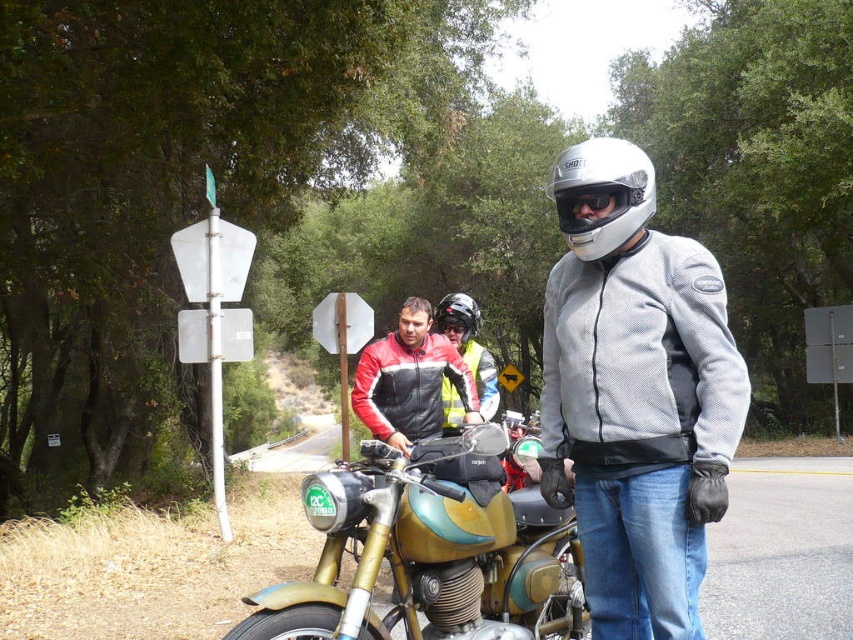
Question: Does gold metallic motorcycle at center have a larger size compared to glossy black helmet at center?

Choices:
 (A) no
 (B) yes

Answer: (A)

Question: Can you confirm if gold metallic motorcycle at center is positioned to the left of silver metallic helmet at center?

Choices:
 (A) yes
 (B) no

Answer: (A)

Question: Which is nearer to the red and black leather jacket at center?

Choices:
 (A) gold metallic motorcycle at center
 (B) silver metallic helmet at center
 (C) silver mesh jacket at center
 (D) black matte goggles at center

Answer: (A)

Question: Among these points, which one is nearest to the camera?

Choices:
 (A) (685, 483)
 (B) (578, 220)
 (C) (463, 337)
 (D) (498, 605)

Answer: (A)

Question: Which object is closer to the camera taking this photo?

Choices:
 (A) silver metallic helmet at center
 (B) gold metallic motorcycle at center
 (C) silver mesh jacket at center
 (D) red and black leather jacket at center

Answer: (C)

Question: Does silver mesh jacket at center appear on the left side of black matte goggles at center?

Choices:
 (A) no
 (B) yes

Answer: (A)